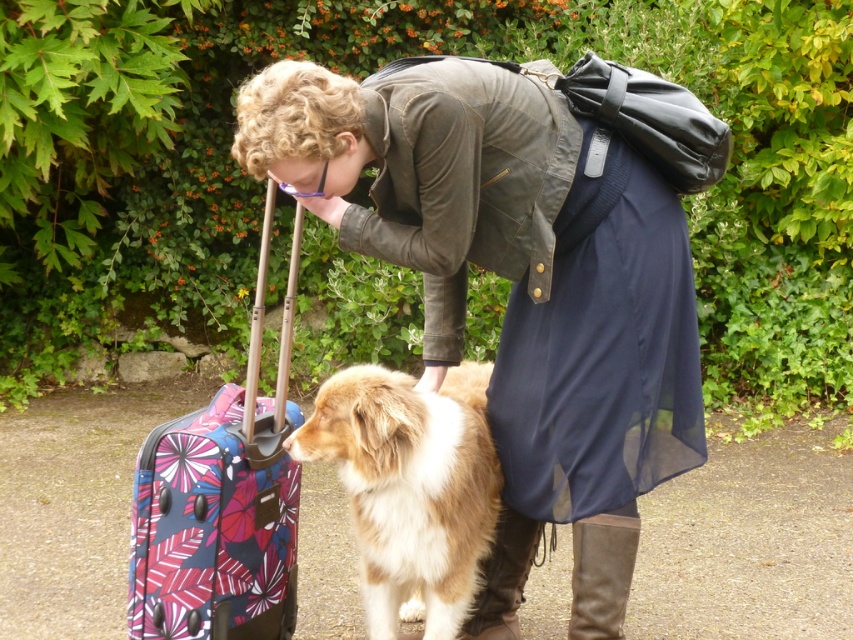
Is point (462, 492) less distant than point (631, 561)?

No, it is behind (631, 561).

You are a GUI agent. You are given a task and a screenshot of the screen. Output one action in this format:
    pyautogui.click(x=<x>, y=<y>)
    Task: Click on the brown fluffy dog at center
    
    Given the screenshot: What is the action you would take?
    pyautogui.click(x=410, y=488)

Between point (492, 486) and point (583, 536), which one is positioned behind?

Point (492, 486)

Find the location of a particular element. brown fluffy dog at center is located at coordinates (x=410, y=488).

Does patterned fabric suitcase at left have a larger size compared to brown leather boot at lower center?

Yes.

Does patterned fabric suitcase at left appear on the left side of brown leather boot at lower center?

Correct, you'll find patterned fabric suitcase at left to the left of brown leather boot at lower center.

Image resolution: width=853 pixels, height=640 pixels. What do you see at coordinates (221, 500) in the screenshot?
I see `patterned fabric suitcase at left` at bounding box center [221, 500].

Image resolution: width=853 pixels, height=640 pixels. What are the coordinates of `patterned fabric suitcase at left` in the screenshot? It's located at (221, 500).

Between matte olive green jacket at center and brown leather boot at lower center, which one has less height?

brown leather boot at lower center

Identify the location of matte olive green jacket at center. (509, 257).